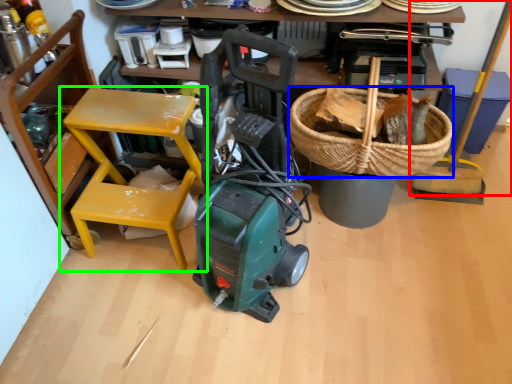
Question: Estimate the real-world distances between objects in this image. Which object is closer to shovel (highlighted by a red box), basket (highlighted by a blue box) or chair (highlighted by a green box)?

Choices:
 (A) basket
 (B) chair

Answer: (A)